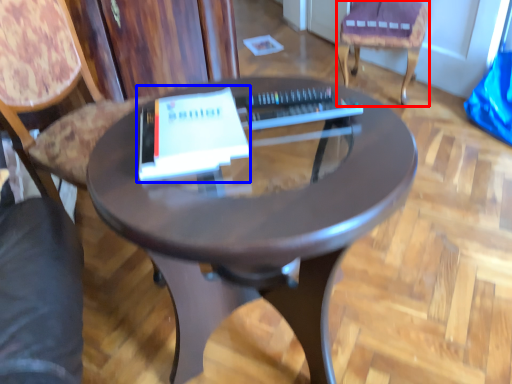
Question: Which of the following is the closest to the observer, chair (highlighted by a red box) or paperback book (highlighted by a blue box)?

Choices:
 (A) chair
 (B) paperback book

Answer: (B)